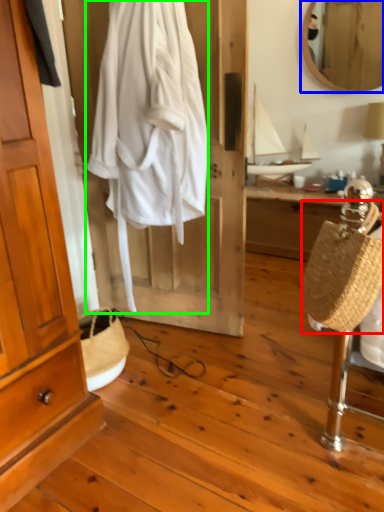
Question: Which object is the farthest from handbag (highlighted by a red box)? Choose among these: mirror (highlighted by a blue box) or clothing (highlighted by a green box).

Choices:
 (A) mirror
 (B) clothing

Answer: (A)